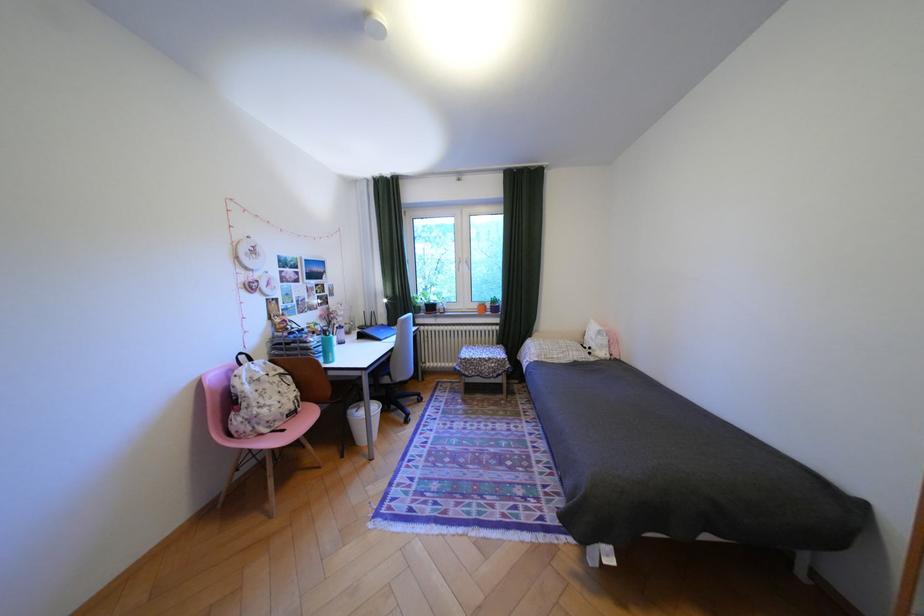
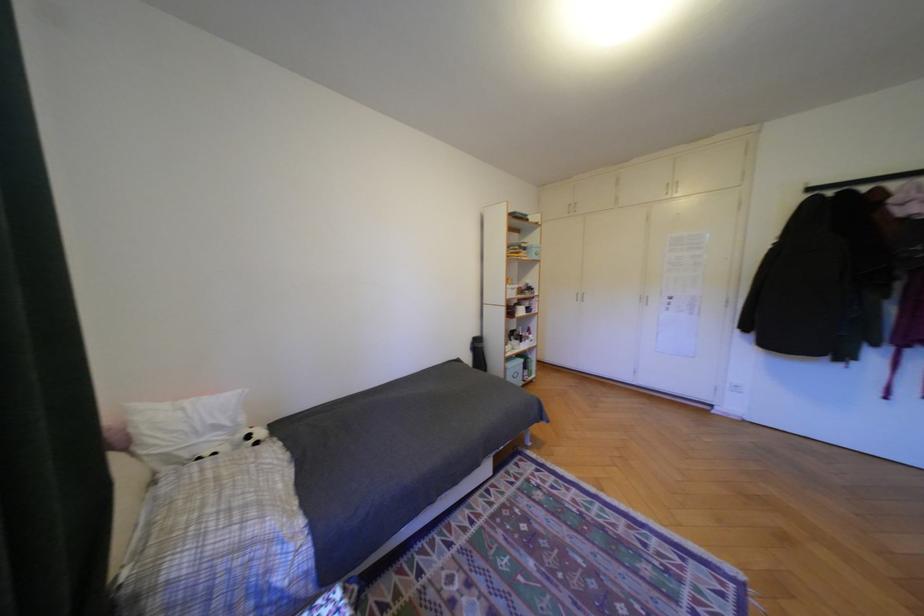
Find the pixel in the second image that matches (602,349) in the first image.

(261, 437)